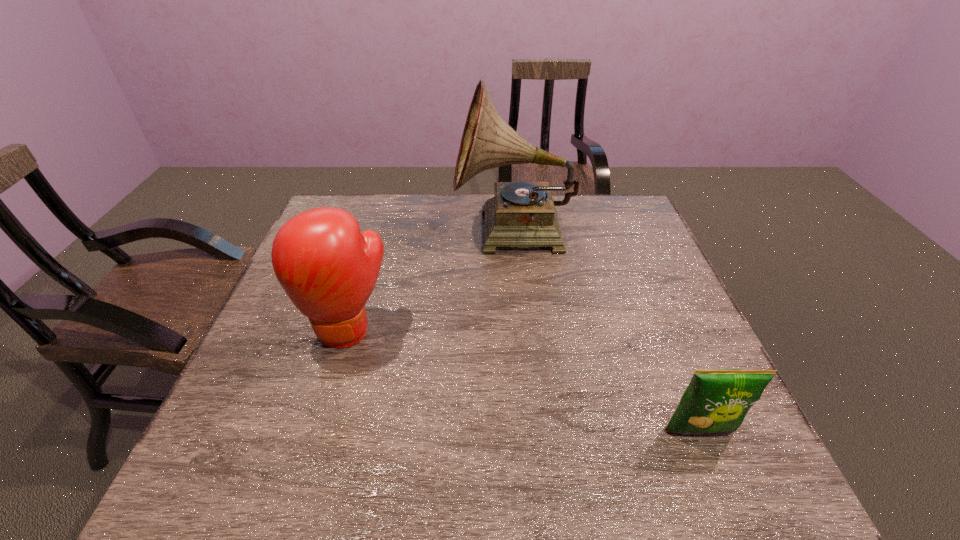
Where is `vacant space located 0.090m on the front-facing side of the crisp (potato chip)`? vacant space located 0.090m on the front-facing side of the crisp (potato chip) is located at coordinates (725, 492).

Where is `object at the far edge`? The height and width of the screenshot is (540, 960). object at the far edge is located at coordinates click(x=521, y=214).

At what (x,y) coordinates should I click in order to perform the action: click on object situated at the left edge. Please return your answer as a coordinate pair (x, y). The image size is (960, 540). Looking at the image, I should click on (328, 269).

I want to click on object present at the right edge, so [715, 400].

Find the location of a particular element. The width and height of the screenshot is (960, 540). free spot at the left edge of the desktop is located at coordinates (253, 385).

Find the location of a particular element. Image resolution: width=960 pixels, height=540 pixels. vacant point at the right edge is located at coordinates (637, 350).

The image size is (960, 540). Identify the location of free point at the far left corner. (359, 203).

The image size is (960, 540). I want to click on free spot at the near left corner of the desktop, so click(x=237, y=489).

Locate an element on the screen. Image resolution: width=960 pixels, height=540 pixels. vacant area at the far right corner is located at coordinates (626, 211).

In the image, there is a desktop. At what (x,y) coordinates should I click in order to perform the action: click on vacant area at the near right corner. Please return your answer as a coordinate pair (x, y). Looking at the image, I should click on (736, 455).